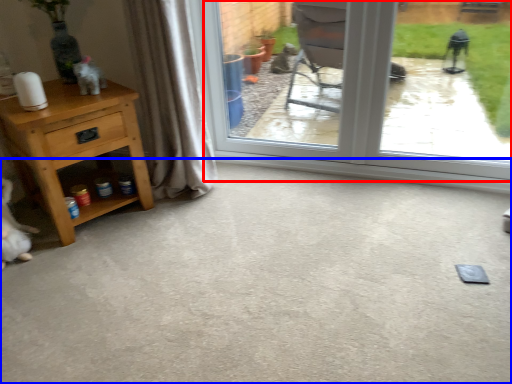
Question: Which of the following is the farthest to the observer, window (highlighted by a red box) or concrete (highlighted by a blue box)?

Choices:
 (A) window
 (B) concrete

Answer: (A)